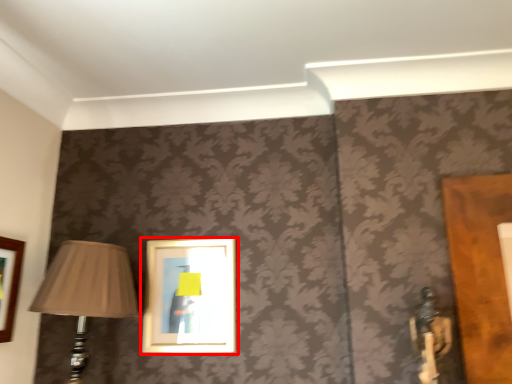
Question: Observing the image, what is the correct spatial positioning of picture frame (annotated by the red box) in reference to lamp?

Choices:
 (A) right
 (B) left

Answer: (A)